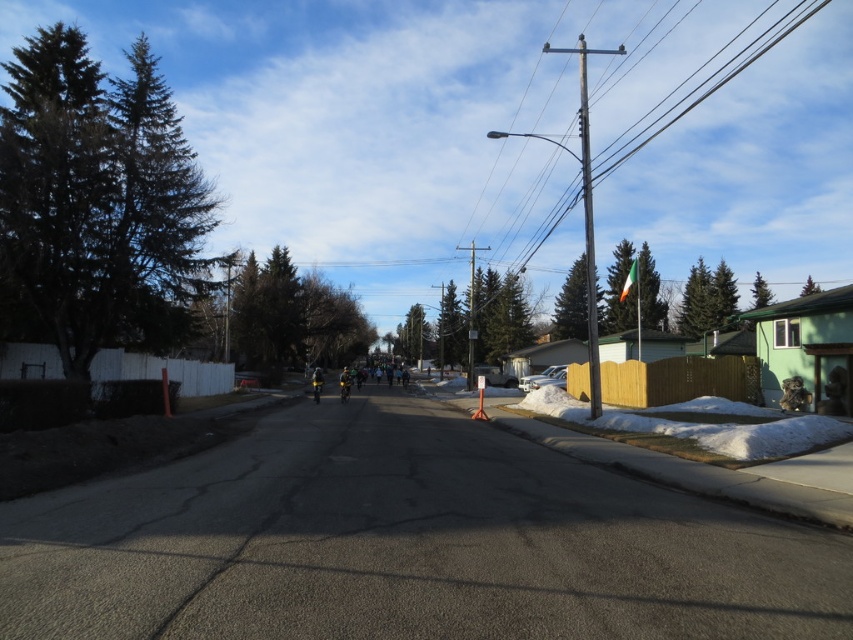
Is point (752, 440) closer to viewer compared to point (802, 17)?

Yes, it is.

Where is `white fluffy snow at lower right`? The image size is (853, 640). white fluffy snow at lower right is located at coordinates (703, 424).

Between point (641, 413) and point (666, 104), which one is positioned behind?

The point (666, 104) is behind.

The image size is (853, 640). Identify the location of white fluffy snow at lower right. (703, 424).